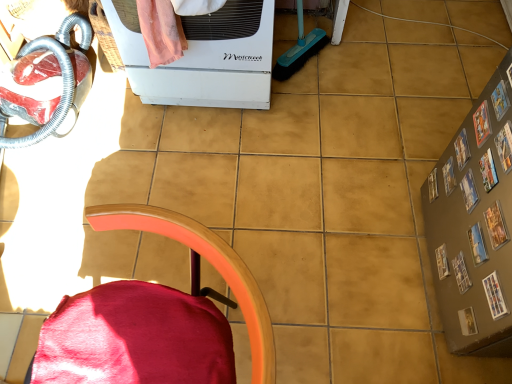
The image size is (512, 384). What do you see at coordinates (202, 56) in the screenshot?
I see `white matte appliance at upper center` at bounding box center [202, 56].

Identify the location of white matte appliance at upper center. This screenshot has height=384, width=512. (202, 56).

Where is `velvet red chair at lower left`? This screenshot has width=512, height=384. velvet red chair at lower left is located at coordinates (167, 312).

What do you see at coordinates (167, 312) in the screenshot? I see `velvet red chair at lower left` at bounding box center [167, 312].

Find the location of `white matte appliance at upper center`. white matte appliance at upper center is located at coordinates (202, 56).

Considering the relative positions of velvet red chair at lower left and white matte appliance at upper center in the image provided, is velvet red chair at lower left to the left of white matte appliance at upper center from the viewer's perspective?

Correct, you'll find velvet red chair at lower left to the left of white matte appliance at upper center.

Is velvet red chair at lower left positioned behind white matte appliance at upper center?

No, velvet red chair at lower left is closer to the viewer.

Is point (229, 355) positioned in front of point (111, 28)?

Yes, it is.

From the image's perspective, is velvet red chair at lower left on top of white matte appliance at upper center?

No, from the image's perspective, velvet red chair at lower left is not on top of white matte appliance at upper center.

From a real-world perspective, is velvet red chair at lower left located beneath white matte appliance at upper center?

No, from a real-world perspective, velvet red chair at lower left is not under white matte appliance at upper center.

Considering the relative sizes of velvet red chair at lower left and white matte appliance at upper center in the image provided, is velvet red chair at lower left thinner than white matte appliance at upper center?

Correct, the width of velvet red chair at lower left is less than that of white matte appliance at upper center.

Who is shorter, velvet red chair at lower left or white matte appliance at upper center?

With less height is white matte appliance at upper center.

Which of these two, velvet red chair at lower left or white matte appliance at upper center, is bigger?

white matte appliance at upper center is bigger.

Based on the photo, is white matte appliance at upper center surrounded by velvet red chair at lower left?

Definitely not — white matte appliance at upper center is not inside velvet red chair at lower left.

Are velvet red chair at lower left and white matte appliance at upper center far apart?

No, velvet red chair at lower left is in close proximity to white matte appliance at upper center.

Based on the photo, could you tell me if velvet red chair at lower left is facing white matte appliance at upper center?

No.

In the scene shown: What's the angular difference between velvet red chair at lower left and white matte appliance at upper center's facing directions?

The facing directions of velvet red chair at lower left and white matte appliance at upper center are 74.1 degrees apart.

How far apart are velvet red chair at lower left and white matte appliance at upper center?

A distance of 80.60 centimeters exists between velvet red chair at lower left and white matte appliance at upper center.

What are the coordinates of `furniture that appears below the white matte appliance at upper center (from the image's perspective)` in the screenshot? It's located at (167, 312).

Is white matte appliance at upper center at the right side of velvet red chair at lower left?

Indeed, white matte appliance at upper center is positioned on the right side of velvet red chair at lower left.

Is white matte appliance at upper center positioned in front of velvet red chair at lower left?

No, white matte appliance at upper center is further to the viewer.

Considering the positions of points (231, 83) and (92, 212), is point (231, 83) closer to camera compared to point (92, 212)?

No, it is behind (92, 212).

From the image's perspective, relative to velvet red chair at lower left, is white matte appliance at upper center above or below?

white matte appliance at upper center is above velvet red chair at lower left.

From a real-world perspective, is white matte appliance at upper center positioned over velvet red chair at lower left based on gravity?

No, from a real-world perspective, white matte appliance at upper center is not above velvet red chair at lower left.

Between white matte appliance at upper center and velvet red chair at lower left, which one has smaller width?

Thinner between the two is velvet red chair at lower left.

Consider the image. Does white matte appliance at upper center have a lesser height compared to velvet red chair at lower left?

Yes.

Looking at the image, does white matte appliance at upper center seem bigger or smaller compared to velvet red chair at lower left?

white matte appliance at upper center is bigger than velvet red chair at lower left.

Can velvet red chair at lower left be found inside white matte appliance at upper center?

No.

Is white matte appliance at upper center far away from velvet red chair at lower left?

white matte appliance at upper center is actually quite close to velvet red chair at lower left.

Is white matte appliance at upper center positioned with its back to velvet red chair at lower left?

No, white matte appliance at upper center is not facing the opposite direction of velvet red chair at lower left.

I want to click on home appliance that appears on the right of velvet red chair at lower left, so click(202, 56).

Where is `furniture above the white matte appliance at upper center (from a real-world perspective)`? The width and height of the screenshot is (512, 384). furniture above the white matte appliance at upper center (from a real-world perspective) is located at coordinates (167, 312).

Identify the location of furniture below the white matte appliance at upper center (from the image's perspective). (167, 312).